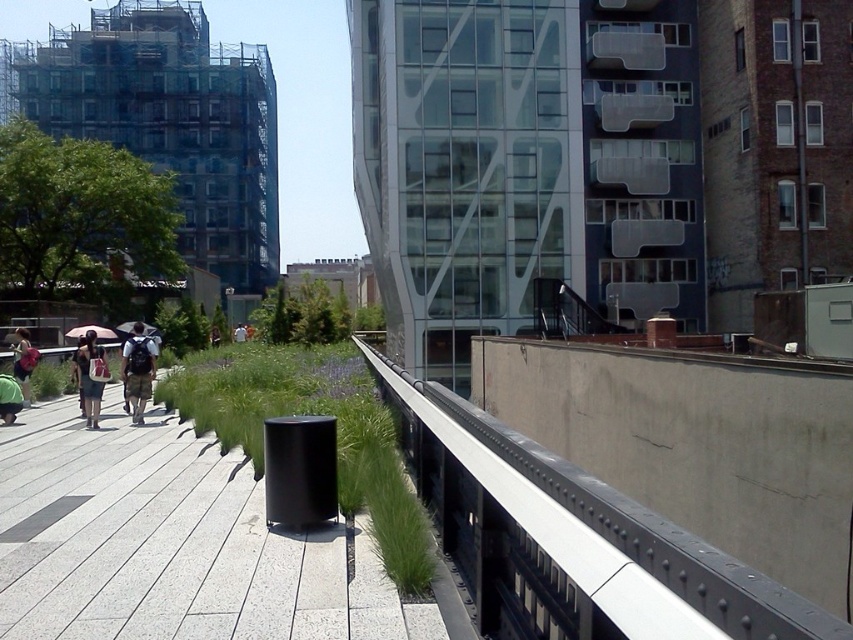
From the picture: Does green grass at center have a smaller size compared to white matte umbrella at upper left?

No.

Is green grass at center positioned in front of white matte umbrella at upper left?

Yes, green grass at center is closer to the viewer.

Describe the element at coordinates (312, 413) in the screenshot. I see `green grass at center` at that location.

This screenshot has width=853, height=640. Find the location of `green grass at center`. green grass at center is located at coordinates (312, 413).

Between matte black backpack at center and pink fabric umbrella at upper left, which one is positioned higher?

pink fabric umbrella at upper left is higher up.

Is point (141, 348) farther from camera compared to point (102, 326)?

No, it is not.

Describe the element at coordinates (138, 371) in the screenshot. Image resolution: width=853 pixels, height=640 pixels. I see `matte black backpack at center` at that location.

Identify the location of matte black backpack at center. (138, 371).

Is matte white backpack at left to the left of denim jacket at left from the viewer's perspective?

In fact, matte white backpack at left is to the right of denim jacket at left.

Does matte white backpack at left have a lesser width compared to denim jacket at left?

No, matte white backpack at left is not thinner than denim jacket at left.

Is point (91, 428) behind point (24, 384)?

No.

Identify the location of matte white backpack at left. The width and height of the screenshot is (853, 640). (91, 376).